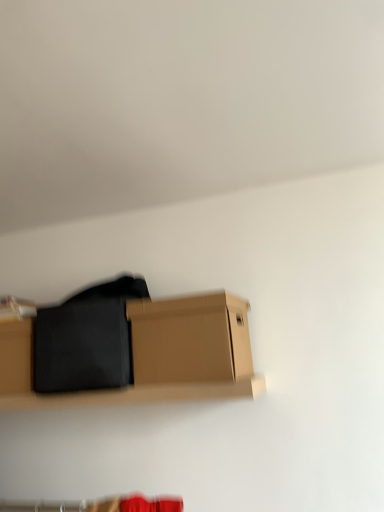
Question: Is point (170, 376) positioned closer to the camera than point (87, 355)?

Choices:
 (A) closer
 (B) farther

Answer: (A)

Question: From the image's perspective, is brown cardboard box at lower center located above or below black matte fabric at center?

Choices:
 (A) below
 (B) above

Answer: (B)

Question: From a real-world perspective, is brown cardboard box at lower center above or below black matte fabric at center?

Choices:
 (A) above
 (B) below

Answer: (B)

Question: Looking at their shapes, would you say black matte fabric at center is wider or thinner than brown cardboard box at lower center?

Choices:
 (A) thin
 (B) wide

Answer: (B)

Question: In the image, is black matte fabric at center positioned in front of or behind brown cardboard box at lower center?

Choices:
 (A) behind
 (B) front

Answer: (A)

Question: In terms of size, does black matte fabric at center appear bigger or smaller than brown cardboard box at lower center?

Choices:
 (A) big
 (B) small

Answer: (A)

Question: Would you say black matte fabric at center is to the left or to the right of brown cardboard box at lower center in the picture?

Choices:
 (A) right
 (B) left

Answer: (B)